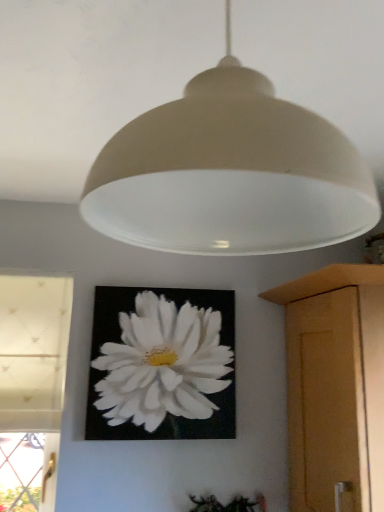
Question: Is matte white lampshade at upper center wider than green matte plant at lower center?

Choices:
 (A) no
 (B) yes

Answer: (B)

Question: From the image's perspective, would you say matte white lampshade at upper center is positioned over green matte plant at lower center?

Choices:
 (A) yes
 (B) no

Answer: (A)

Question: Can you confirm if matte white lampshade at upper center is taller than green matte plant at lower center?

Choices:
 (A) yes
 (B) no

Answer: (A)

Question: Considering the relative sizes of matte white lampshade at upper center and green matte plant at lower center in the image provided, is matte white lampshade at upper center shorter than green matte plant at lower center?

Choices:
 (A) no
 (B) yes

Answer: (A)

Question: From the image's perspective, is matte white lampshade at upper center below green matte plant at lower center?

Choices:
 (A) no
 (B) yes

Answer: (A)

Question: Considering the positions of matte white lampshade at upper center and wooden cabinet at right in the image, is matte white lampshade at upper center taller or shorter than wooden cabinet at right?

Choices:
 (A) tall
 (B) short

Answer: (B)

Question: In terms of width, does matte white lampshade at upper center look wider or thinner when compared to wooden cabinet at right?

Choices:
 (A) thin
 (B) wide

Answer: (A)

Question: In terms of size, does matte white lampshade at upper center appear bigger or smaller than wooden cabinet at right?

Choices:
 (A) small
 (B) big

Answer: (A)

Question: Choose the correct answer: Is matte white lampshade at upper center inside wooden cabinet at right or outside it?

Choices:
 (A) outside
 (B) inside

Answer: (A)

Question: From a real-world perspective, is white textured fabric at left positioned above or below matte white lampshade at upper center?

Choices:
 (A) below
 (B) above

Answer: (A)

Question: Does point pos(49,463) appear closer or farther from the camera than point pos(92,203)?

Choices:
 (A) closer
 (B) farther

Answer: (B)

Question: Considering the positions of white textured fabric at left and matte white lampshade at upper center in the image, is white textured fabric at left wider or thinner than matte white lampshade at upper center?

Choices:
 (A) wide
 (B) thin

Answer: (B)

Question: Relative to matte white lampshade at upper center, is white textured fabric at left in front or behind?

Choices:
 (A) front
 (B) behind

Answer: (B)

Question: From the image's perspective, relative to white textured fabric at left, is wooden cabinet at right above or below?

Choices:
 (A) below
 (B) above

Answer: (B)

Question: Considering the positions of wooden cabinet at right and white textured fabric at left in the image, is wooden cabinet at right bigger or smaller than white textured fabric at left?

Choices:
 (A) small
 (B) big

Answer: (B)